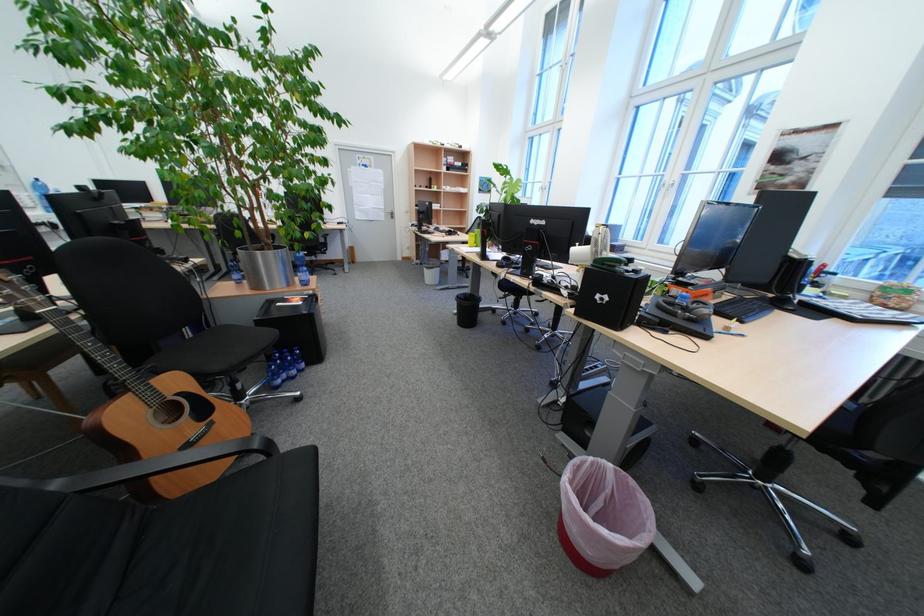
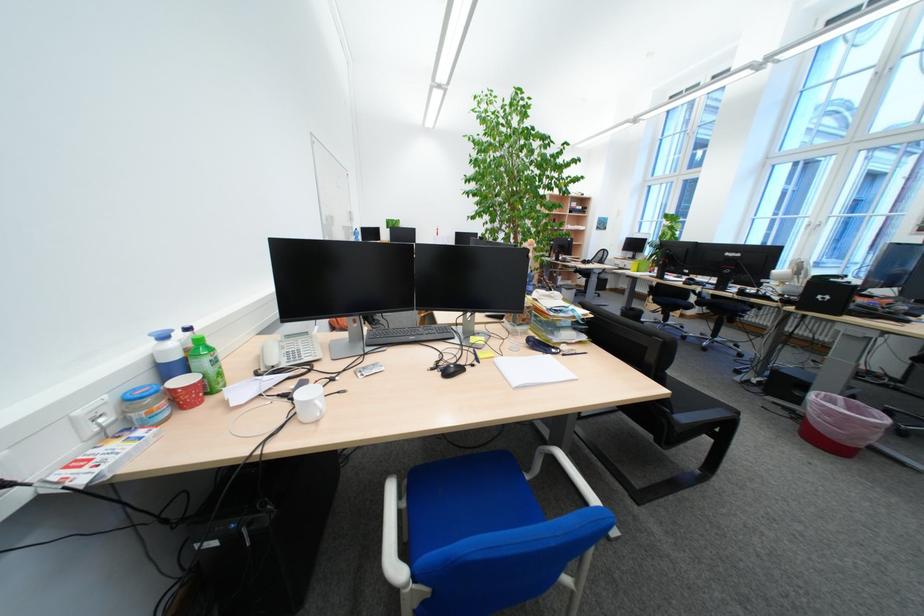
What movement of the cameraman would produce the second image?

The cameraman walked toward left, backward.